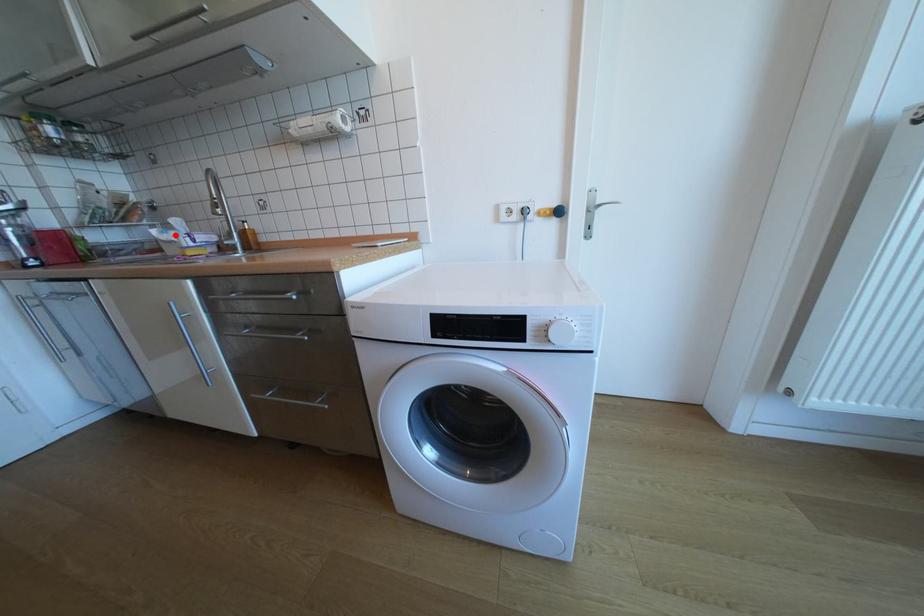
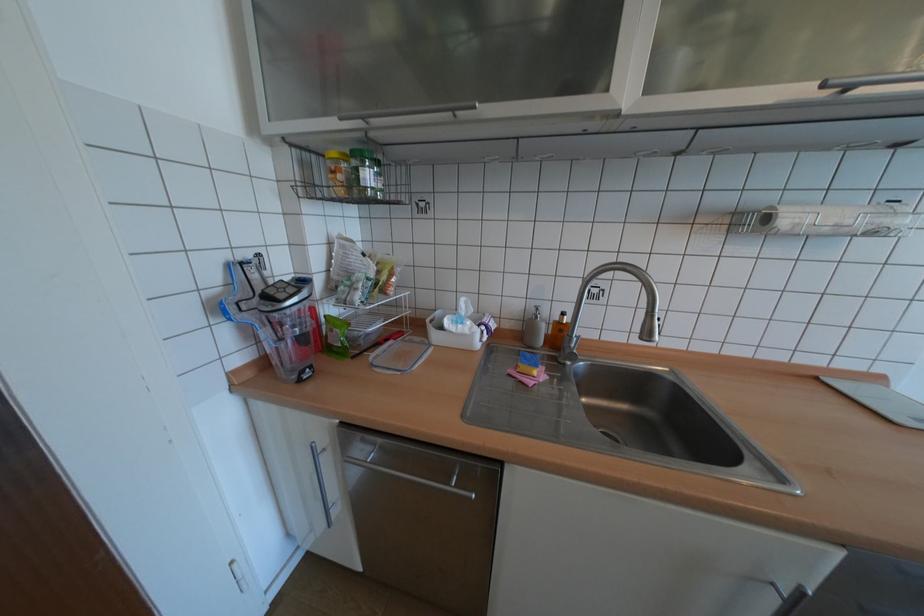
The point at the highlighted location is marked in the first image. Where is the corresponding point in the second image?

(468, 326)